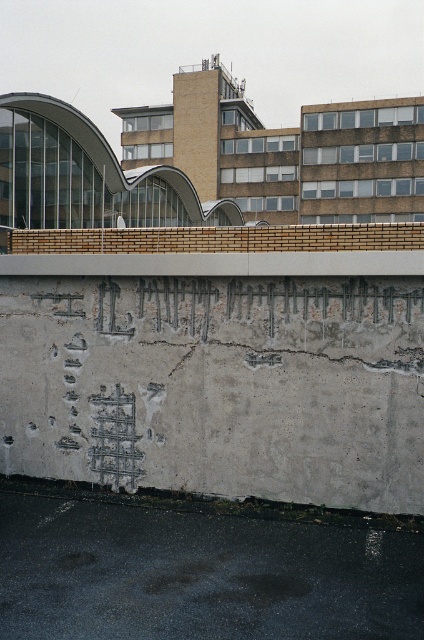
You are standing in front of an urban scene with a weathered concrete wall. You see the gray concrete wall at center and the gray concrete at lower center. Which of these two objects is positioned to the left?

The gray concrete wall at center is positioned to the left of the gray concrete at lower center.

You are a painter who needs to paint a gray concrete wall at center and a gray concrete at lower center. You have a ladder that can reach 1 meter. Can you reach both areas with your ladder?

The gray concrete wall at center is 93.14 centimeters from gray concrete at lower center. Since the ladder can reach 1 meter, you can reach both areas with your ladder.

You are standing in an urban area and see the gray concrete wall at center. Can you determine its exact location based on the coordinates provided?

The gray concrete wall at center is located at point (217, 385).